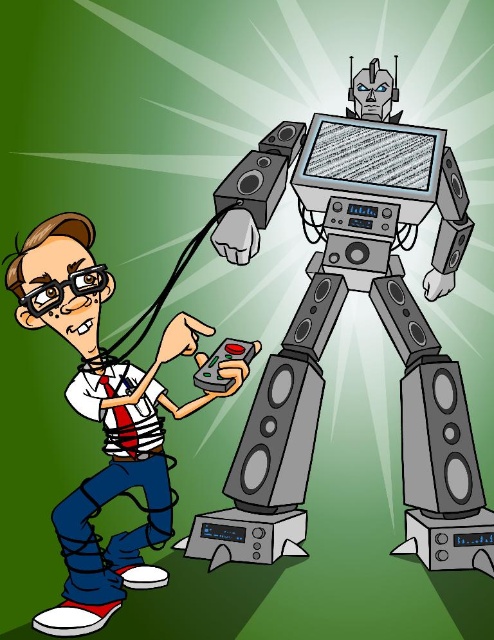
Question: Is matte black shirt at left further to camera compared to satin black speaker at center?

Choices:
 (A) no
 (B) yes

Answer: (A)

Question: Does satin black speaker at center appear on the left side of metallic gray speaker at lower right?

Choices:
 (A) yes
 (B) no

Answer: (A)

Question: Estimate the real-world distances between objects in this image. Which object is farther from the matte black shirt at left?

Choices:
 (A) satin black speaker at center
 (B) metallic gray speaker at lower right

Answer: (B)

Question: Based on their relative distances, which object is farther from the metallic gray speaker at lower right?

Choices:
 (A) matte black shirt at left
 (B) satin black speaker at center

Answer: (A)

Question: Among these points, which one is nearest to the camera?

Choices:
 (A) (439, 461)
 (B) (302, 401)

Answer: (A)

Question: Does satin black speaker at center have a smaller size compared to metallic gray speaker at lower right?

Choices:
 (A) yes
 (B) no

Answer: (B)